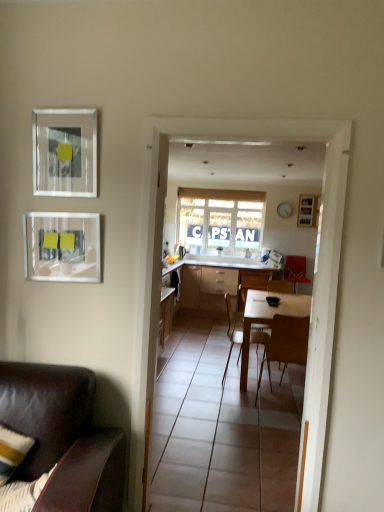
Measure the distance between point (316, 198) and camera.

They are 6.61 meters apart.

What do you see at coordinates (295, 270) in the screenshot?
I see `velvet red chair at right, arranged as the 5th chair when viewed from the left` at bounding box center [295, 270].

Describe the element at coordinates (62, 247) in the screenshot. I see `matte glass picture frame at upper left, which ranks as the first picture frame in bottom-to-top order` at that location.

Where is `matte glass picture frame at upper left, the first picture frame in the left-to-right sequence`? This screenshot has width=384, height=512. matte glass picture frame at upper left, the first picture frame in the left-to-right sequence is located at coordinates (62, 247).

Where is `matte glass picture frame at upper left, which ranks as the first picture frame in front-to-back order`? The height and width of the screenshot is (512, 384). matte glass picture frame at upper left, which ranks as the first picture frame in front-to-back order is located at coordinates (65, 152).

From the picture: Is brown wooden chair at center, which is counted as the second chair, starting from the right, at the back of wooden chair at center, acting as the third chair starting from the right?

No, wooden chair at center, acting as the third chair starting from the right,'s orientation is not away from brown wooden chair at center, which is counted as the second chair, starting from the right.

Between wooden chair at center, acting as the third chair starting from the left, and brown wooden chair at center, which is counted as the second chair, starting from the right, which one has larger width?

wooden chair at center, acting as the third chair starting from the left.

Would you say wooden chair at center, which is the 4th chair from front to back, is to the left or to the right of brown wooden chair at center, the fourth chair viewed from the back, in the picture?

wooden chair at center, which is the 4th chair from front to back, is to the left of brown wooden chair at center, the fourth chair viewed from the back.

Is point (284, 286) in front of point (277, 353)?

That is False.

Between matte glass picture frame at upper left, positioned as the 3th picture frame in back-to-front order, and transparent plastic window at center, which one has smaller size?

Smaller between the two is matte glass picture frame at upper left, positioned as the 3th picture frame in back-to-front order.

Is matte glass picture frame at upper left, marked as the 2th picture frame in a top-to-bottom arrangement, looking in the opposite direction of transparent plastic window at center?

Yes, transparent plastic window at center is at the back of matte glass picture frame at upper left, marked as the 2th picture frame in a top-to-bottom arrangement.

In order to click on the 1st picture frame to the left of the transparent plastic window at center, counting from the anchor's position in this screenshot , I will do `click(65, 152)`.

From the image's perspective, is matte glass picture frame at upper left, marked as the 2th picture frame in a top-to-bottom arrangement, under transparent plastic window at center?

Indeed, from the image's perspective, matte glass picture frame at upper left, marked as the 2th picture frame in a top-to-bottom arrangement, is shown beneath transparent plastic window at center.

From a real-world perspective, who is located lower, wooden chair at center, positioned as the 2th chair in left-to-right order, or wooden picture frame at upper right, which is the 3th picture frame in bottom-to-top order?

From a 3D spatial view, wooden chair at center, positioned as the 2th chair in left-to-right order, is below.

Is point (230, 334) positioned in front of point (303, 220)?

That is True.

In the scene shown: Is wooden chair at center, which is the fourth chair from right to left, shorter than wooden picture frame at upper right, marked as the 3th picture frame in a front-to-back arrangement?

Incorrect, the height of wooden chair at center, which is the fourth chair from right to left, does not fall short of that of wooden picture frame at upper right, marked as the 3th picture frame in a front-to-back arrangement.

Is wooden chair at center, positioned as the 2th chair in left-to-right order, next to wooden picture frame at upper right, the 1th picture frame when ordered from top to bottom?

wooden chair at center, positioned as the 2th chair in left-to-right order, and wooden picture frame at upper right, the 1th picture frame when ordered from top to bottom, are clearly separated.

From the image's perspective, is matte glass picture frame at upper left, which ranks as the first picture frame in bottom-to-top order, above or below matte glass picture frame at upper left, marked as the 2th picture frame in a top-to-bottom arrangement?

From the image's perspective, matte glass picture frame at upper left, which ranks as the first picture frame in bottom-to-top order, appears below matte glass picture frame at upper left, marked as the 2th picture frame in a top-to-bottom arrangement.

From the picture: Can you confirm if matte glass picture frame at upper left, acting as the 2th picture frame starting from the front, is shorter than matte glass picture frame at upper left, which is the 2th picture frame in left-to-right order?

Correct, matte glass picture frame at upper left, acting as the 2th picture frame starting from the front, is not as tall as matte glass picture frame at upper left, which is the 2th picture frame in left-to-right order.

Considering the relative sizes of matte glass picture frame at upper left, acting as the third picture frame starting from the right, and matte glass picture frame at upper left, which is the 2th picture frame in left-to-right order, in the image provided, is matte glass picture frame at upper left, acting as the third picture frame starting from the right, smaller than matte glass picture frame at upper left, which is the 2th picture frame in left-to-right order,?

No, matte glass picture frame at upper left, acting as the third picture frame starting from the right, is not smaller than matte glass picture frame at upper left, which is the 2th picture frame in left-to-right order.

Is matte glass picture frame at upper left, acting as the third picture frame starting from the right, further to the viewer compared to matte glass picture frame at upper left, positioned as the 3th picture frame in back-to-front order?

Yes, matte glass picture frame at upper left, acting as the third picture frame starting from the right, is further from the camera.

Does transparent plastic window at center appear on the right side of velvet red chair at right, marked as the first chair in a back-to-front arrangement?

No.

Considering the sizes of objects transparent plastic window at center and velvet red chair at right, the 5th chair positioned from the front, in the image provided, who is shorter, transparent plastic window at center or velvet red chair at right, the 5th chair positioned from the front,?

Standing shorter between the two is velvet red chair at right, the 5th chair positioned from the front.

Would you say transparent plastic window at center is inside or outside velvet red chair at right, marked as the first chair in a back-to-front arrangement?

The correct answer is: outside.

Can you tell me how much transparent plastic window at center and velvet red chair at right, the first chair positioned from the right, differ in facing direction?

There is a 0.388-degree angle between the facing directions of transparent plastic window at center and velvet red chair at right, the first chair positioned from the right.

Would you say brown leather chair at lower left, which ranks as the first chair in front-to-back order, is part of wooden chair at center, which is the fourth chair from right to left,'s contents?

Actually, brown leather chair at lower left, which ranks as the first chair in front-to-back order, is outside wooden chair at center, which is the fourth chair from right to left.

Who is more distant, wooden chair at center, positioned as the 2th chair in left-to-right order, or brown leather chair at lower left, the fifth chair viewed from the right?

wooden chair at center, positioned as the 2th chair in left-to-right order.

Between point (261, 327) and point (107, 510), which one is positioned in front?

Point (107, 510)

Considering the positions of objects wooden chair at center, which is the third chair from back to front, and brown leather chair at lower left, marked as the fifth chair in a back-to-front arrangement, in the image provided, who is more to the right, wooden chair at center, which is the third chair from back to front, or brown leather chair at lower left, marked as the fifth chair in a back-to-front arrangement,?

wooden chair at center, which is the third chair from back to front, is more to the right.

Is brown wooden chair at center, which is the second chair from front to back, smaller than matte glass picture frame at upper left, positioned as the 3th picture frame in back-to-front order?

Incorrect, brown wooden chair at center, which is the second chair from front to back, is not smaller in size than matte glass picture frame at upper left, positioned as the 3th picture frame in back-to-front order.

Which of these two, brown wooden chair at center, the fourth chair viewed from the back, or matte glass picture frame at upper left, which is the second picture frame from bottom to top, is wider?

brown wooden chair at center, the fourth chair viewed from the back.

Based on the photo, is brown wooden chair at center, which is counted as the second chair, starting from the right, facing away from matte glass picture frame at upper left, which is the 2th picture frame in left-to-right order?

No, brown wooden chair at center, which is counted as the second chair, starting from the right, is not facing away from matte glass picture frame at upper left, which is the 2th picture frame in left-to-right order.

Which of these two, brown wooden chair at center, acting as the 4th chair starting from the left, or matte glass picture frame at upper left, positioned as the 3th picture frame in back-to-front order, stands shorter?

matte glass picture frame at upper left, positioned as the 3th picture frame in back-to-front order, is shorter.

Find the location of `the 1st chair positioned below the wooden chair at center, acting as the third chair starting from the left (from a real-world perspective)`. the 1st chair positioned below the wooden chair at center, acting as the third chair starting from the left (from a real-world perspective) is located at coordinates (285, 345).

What are the coordinates of `the 2nd picture frame above the transparent plastic window at center (from a real-world perspective)` in the screenshot? It's located at (65, 152).

Estimate the real-world distances between objects in this image. Which object is closer to wooden chair at center, positioned as the 2th chair in left-to-right order, brown leather chair at lower left, which ranks as the first chair in front-to-back order, or transparent glass door at center?

transparent glass door at center is closer to wooden chair at center, positioned as the 2th chair in left-to-right order.

Looking at the image, which one is located closer to transparent glass door at center, white glossy table at center or velvet red chair at right, arranged as the 5th chair when viewed from the left?

velvet red chair at right, arranged as the 5th chair when viewed from the left, is positioned closer to the anchor transparent glass door at center.

Based on their spatial positions, is wooden picture frame at upper right, which ranks as the first picture frame in right-to-left order, or transparent plastic window at center further from transparent glass door at center?

Based on the image, wooden picture frame at upper right, which ranks as the first picture frame in right-to-left order, appears to be further to transparent glass door at center.

Which object lies nearer to the anchor point brown leather chair at lower left, the first chair from the left, transparent glass door at center or wooden picture frame at upper right, which ranks as the first picture frame in right-to-left order?

transparent glass door at center lies closer to brown leather chair at lower left, the first chair from the left, than the other object.

Which object lies nearer to the anchor point wooden picture frame at upper right, marked as the 3th picture frame in a front-to-back arrangement, white glossy table at center or brown leather chair at lower left, the first chair from the left?

white glossy table at center is closer to wooden picture frame at upper right, marked as the 3th picture frame in a front-to-back arrangement.

From the image, which object appears to be farther from brown wooden chair at center, the fourth chair viewed from the back, transparent glass door at center or wooden chair at center, acting as the third chair starting from the right?

wooden chair at center, acting as the third chair starting from the right, is positioned further to the anchor brown wooden chair at center, the fourth chair viewed from the back.

When comparing their distances from wooden chair at center, which is the third chair from back to front, does white glossy table at center or transparent plastic window at center seem further?

transparent plastic window at center is further to wooden chair at center, which is the third chair from back to front.

When comparing their distances from brown wooden chair at center, the fourth chair viewed from the back, does transparent glass door at center or brown leather chair at lower left, the fifth chair viewed from the right, seem further?

brown leather chair at lower left, the fifth chair viewed from the right, lies further to brown wooden chair at center, the fourth chair viewed from the back, than the other object.

Where is `picture frame between wooden chair at center, which is the third chair from back to front, and transparent plastic window at center in the front-back direction`? picture frame between wooden chair at center, which is the third chair from back to front, and transparent plastic window at center in the front-back direction is located at coordinates (307, 211).

Where is `table between transparent plastic window at center and wooden picture frame at upper right, the 1th picture frame when ordered from top to bottom`? The width and height of the screenshot is (384, 512). table between transparent plastic window at center and wooden picture frame at upper right, the 1th picture frame when ordered from top to bottom is located at coordinates (213, 279).

Identify the location of glass door located between brown leather chair at lower left, which ranks as the first chair in front-to-back order, and brown wooden chair at center, the fourth chair viewed from the back, in the depth direction. (315, 275).

What are the coordinates of `picture frame situated between matte glass picture frame at upper left, which ranks as the first picture frame in bottom-to-top order, and brown wooden chair at center, which is the second chair from front to back, from left to right` in the screenshot? It's located at (65, 152).